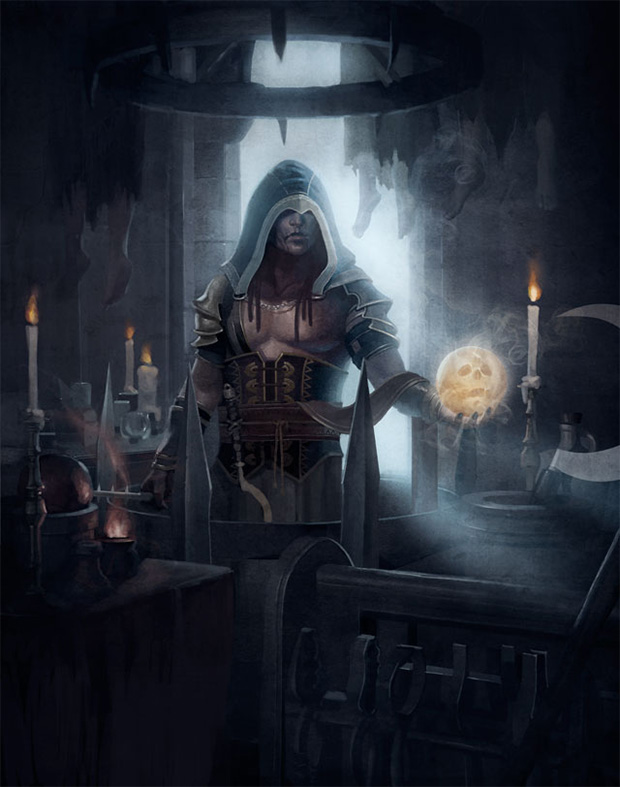
Find the location of a particular element. Image resolution: width=620 pixels, height=787 pixels. window is located at coordinates (321, 135).